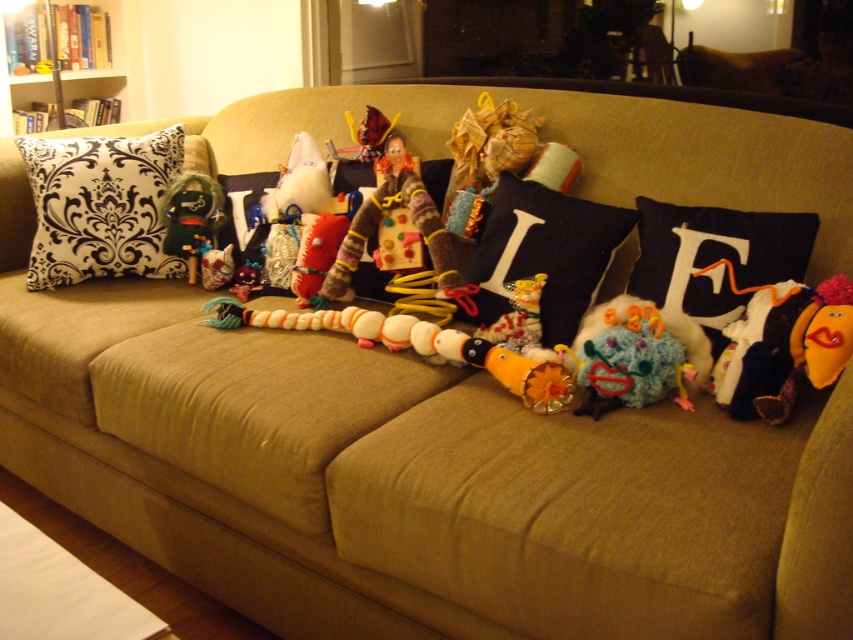
You are arranging a display on a shelf that requires the shorter item to be placed in front. You have the orange plush toy at right and the fuzzy fabric doll at center. Which one should you place in front?

The orange plush toy at right should be placed in front because it has a lesser height compared to the fuzzy fabric doll at center.

From the picture: You are arranging a living room and want to place a new decorative item between the black damask fabric pillow at left and the fluffy orange and white toy at center. Based on their current positions, where should you place the new item?

The new decorative item should be placed between the black damask fabric pillow at left and the fluffy orange and white toy at center, since the pillow is on the left side of the toy.

You are arranging a living room display and want to place a new decorative item between the orange plush toy at right and the fuzzy fabric doll at center. Based on their positions, where should you place the new item?

The orange plush toy at right is in front of the fuzzy fabric doll at center, so placing the new item between them would require positioning it in front of the fuzzy fabric doll at center and behind the orange plush toy at right.